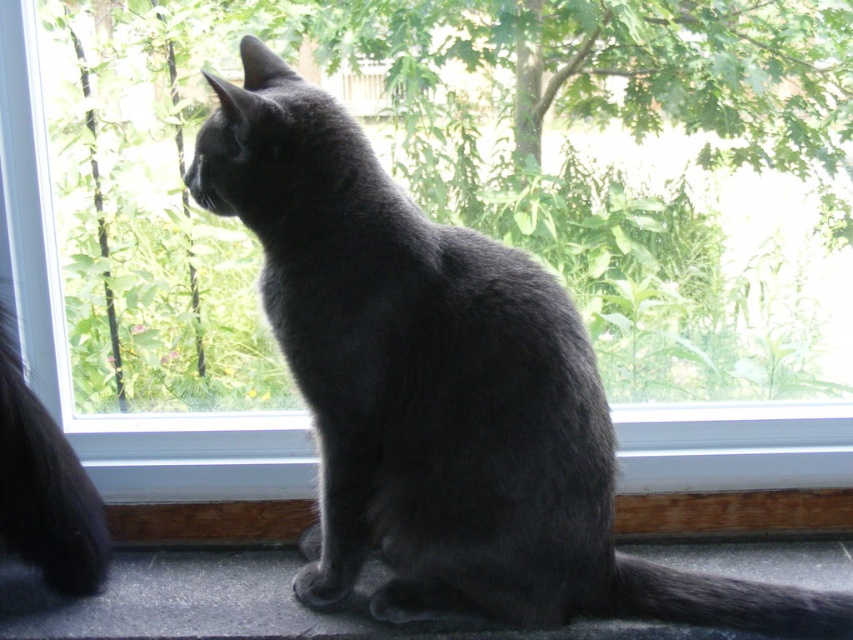
Question: Can you confirm if shiny black cat at center is positioned to the left of shiny black fur at left?

Choices:
 (A) no
 (B) yes

Answer: (A)

Question: Observing the image, what is the correct spatial positioning of shiny black cat at center in reference to shiny black fur at left?

Choices:
 (A) right
 (B) left

Answer: (A)

Question: Which point is farther to the camera?

Choices:
 (A) (316, 144)
 (B) (137, 625)
 (C) (7, 406)

Answer: (B)

Question: Which of these objects is positioned closest to the shiny black fur at left?

Choices:
 (A) shiny black cat at center
 (B) matte gray cat at lower center

Answer: (B)

Question: Does shiny black cat at center have a lesser width compared to shiny black fur at left?

Choices:
 (A) yes
 (B) no

Answer: (B)

Question: Which point is closer to the camera?

Choices:
 (A) shiny black cat at center
 (B) matte gray cat at lower center
 (C) shiny black fur at left

Answer: (A)